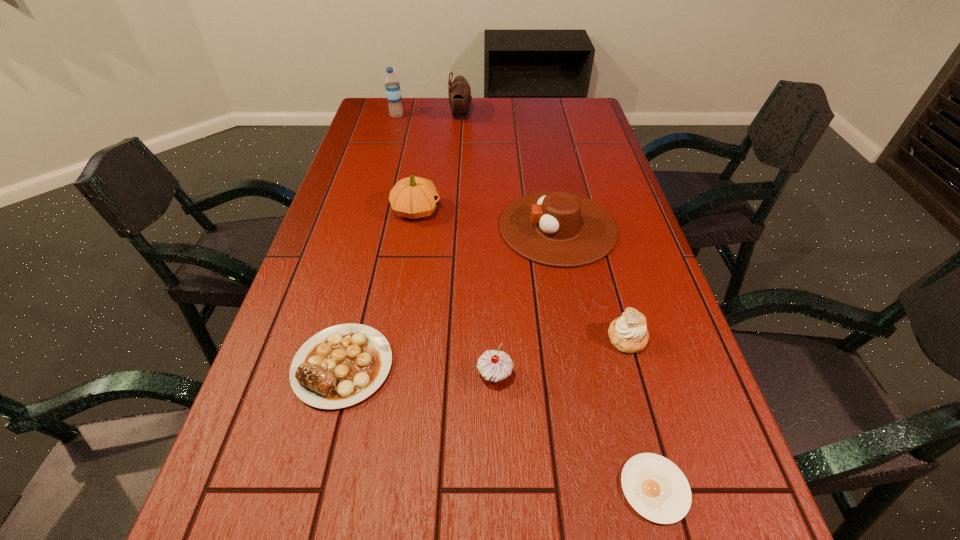
Find the location of a particular element. This screenshot has height=540, width=960. object that can be found as the third closest to the nearest object is located at coordinates (340, 366).

Identify the location of vacant space that satisfies the following two spatial constraints: 1. on the back side of the pastry; 2. on the label of the water bottle. (564, 116).

Identify the location of free space that satisfies the following two spatial constraints: 1. with the flap open on the shortest object; 2. on the right side of the second tallest object. The width and height of the screenshot is (960, 540). (437, 488).

Where is `vacant space that satisfies the following two spatial constraints: 1. on the back side of the egg yolk; 2. with the flap open on the seventh shortest object`? vacant space that satisfies the following two spatial constraints: 1. on the back side of the egg yolk; 2. with the flap open on the seventh shortest object is located at coordinates (557, 115).

At what (x,y) coordinates should I click in order to perform the action: click on free location that satisfies the following two spatial constraints: 1. on the front-facing side of the cowboy hat; 2. on the left side of the nearest object. Please return your answer as a coordinate pair (x, y). This screenshot has width=960, height=540. Looking at the image, I should click on (608, 488).

Find the location of a particular element. The height and width of the screenshot is (540, 960). vacant space that satisfies the following two spatial constraints: 1. on the back side of the egg yolk; 2. on the front-facing side of the cowboy hat is located at coordinates (587, 227).

The width and height of the screenshot is (960, 540). In order to click on vacant space that satisfies the following two spatial constraints: 1. on the label of the nearest object; 2. on the left side of the water bottle in this screenshot , I will do `click(292, 488)`.